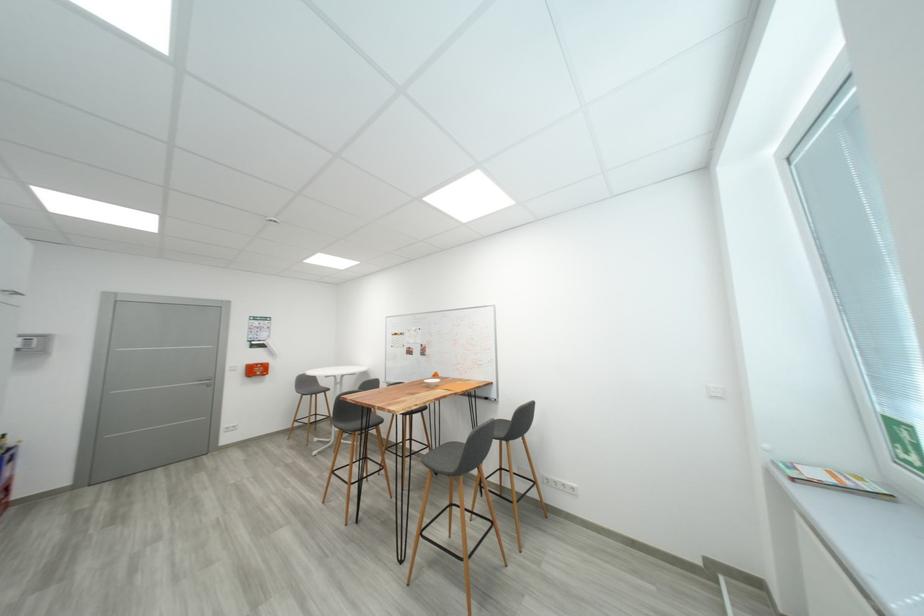
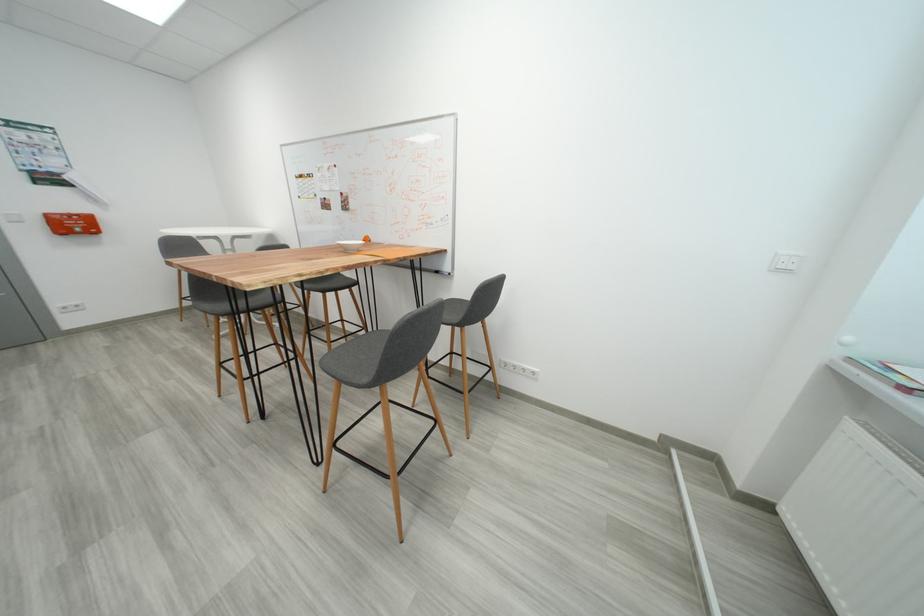
In the second image, find the point that corresponds to [441,448] in the first image.

(377, 331)